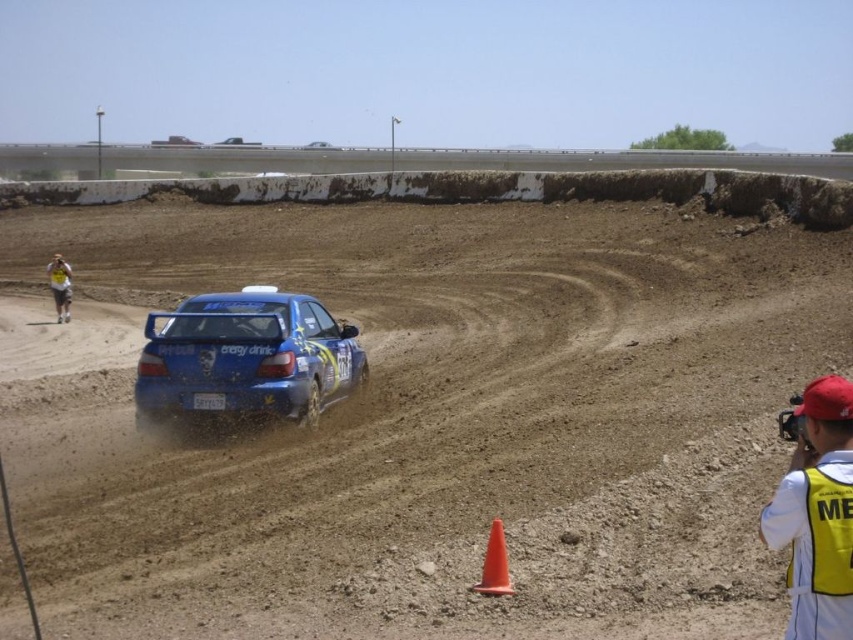
Based on the scene description, what is located at the coordinate point (621, 161)?

The point (621, 161) corresponds to brown dirt at upper center.